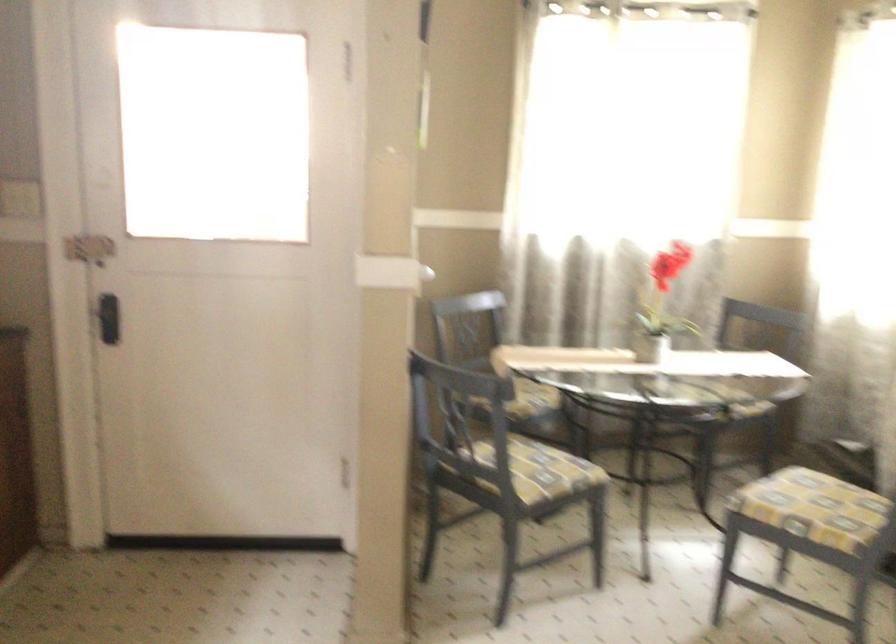
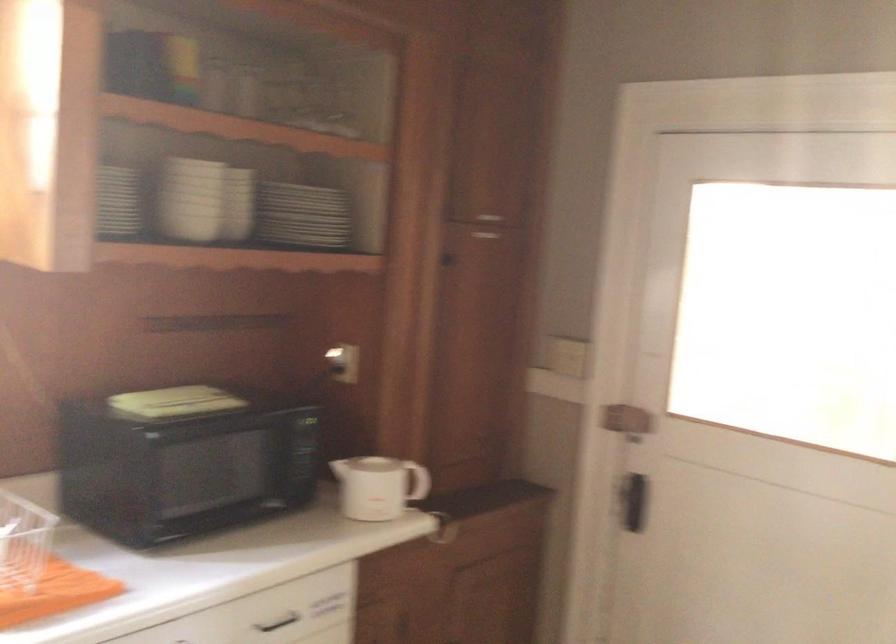
Question: How did the camera likely rotate?

Choices:
 (A) Left
 (B) Right
 (C) Up
 (D) Down

Answer: (A)